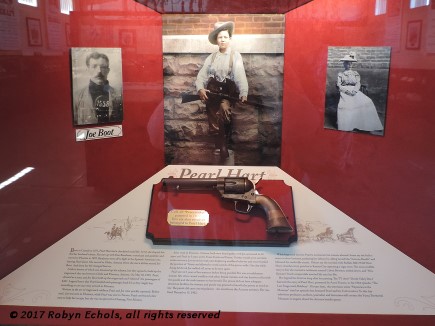
This screenshot has width=435, height=326. I want to click on handle, so click(x=277, y=217).